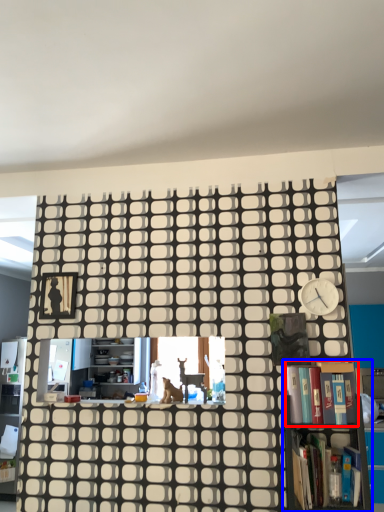
Question: Which of the following is the farthest to the observer, book (highlighted by a red box) or bookcase (highlighted by a blue box)?

Choices:
 (A) book
 (B) bookcase

Answer: (A)